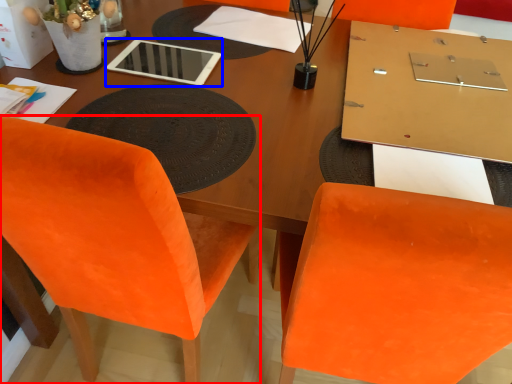
Question: Which object is closer to the camera taking this photo, chair (highlighted by a red box) or tablet computer (highlighted by a blue box)?

Choices:
 (A) chair
 (B) tablet computer

Answer: (A)